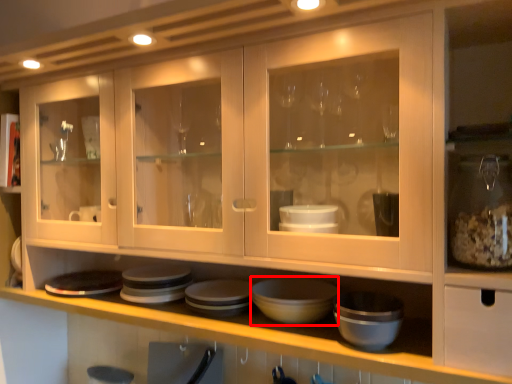
Question: From the image's perspective, considering the relative positions of basin (annotated by the red box) and platter in the image provided, where is basin (annotated by the red box) located with respect to the staircase?

Choices:
 (A) below
 (B) above

Answer: (B)